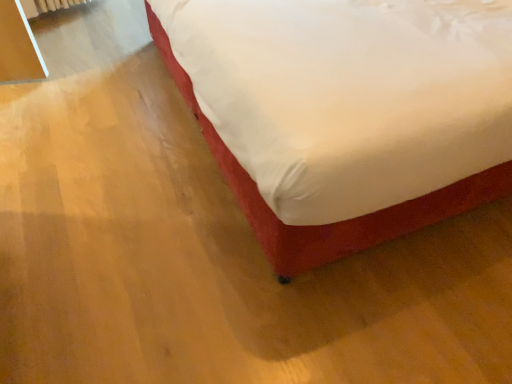
This screenshot has width=512, height=384. What do you see at coordinates (335, 223) in the screenshot?
I see `matte white bed at center` at bounding box center [335, 223].

The width and height of the screenshot is (512, 384). In order to click on matte white bed at center in this screenshot , I will do `click(335, 223)`.

Identify the location of matte white bed at center. (335, 223).